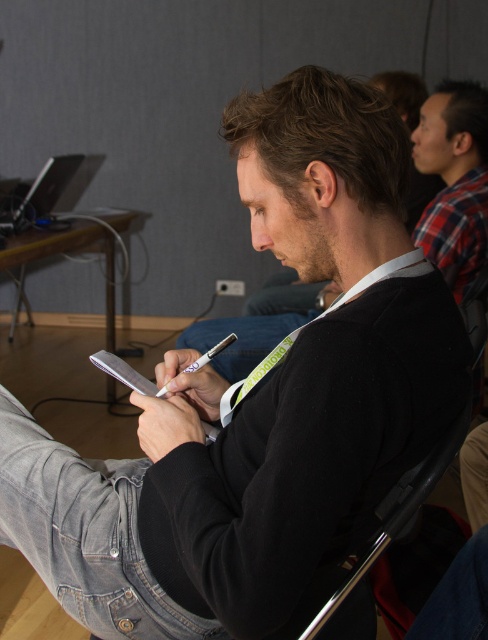
Question: Which of the following is the closest to the observer?

Choices:
 (A) black matte jacket at center
 (B) plaid fabric shirt at upper right

Answer: (A)

Question: Is black matte jacket at center behind plaid fabric shirt at upper right?

Choices:
 (A) no
 (B) yes

Answer: (A)

Question: Does black matte jacket at center have a larger size compared to plaid fabric shirt at upper right?

Choices:
 (A) yes
 (B) no

Answer: (A)

Question: Which object appears closest to the camera in this image?

Choices:
 (A) plaid fabric shirt at upper right
 (B) black matte jacket at center

Answer: (B)

Question: Does black matte jacket at center lie in front of plaid fabric shirt at upper right?

Choices:
 (A) no
 (B) yes

Answer: (B)